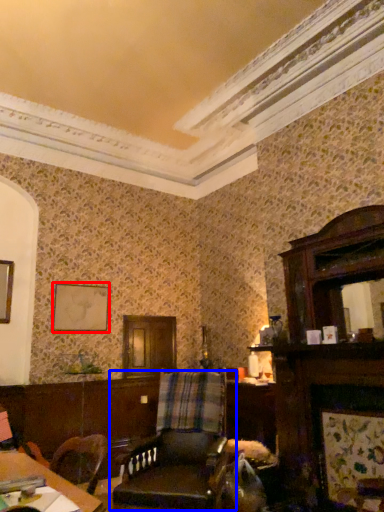
Question: Which of the following is the farthest to the observer, picture frame (highlighted by a red box) or chair (highlighted by a blue box)?

Choices:
 (A) picture frame
 (B) chair

Answer: (A)